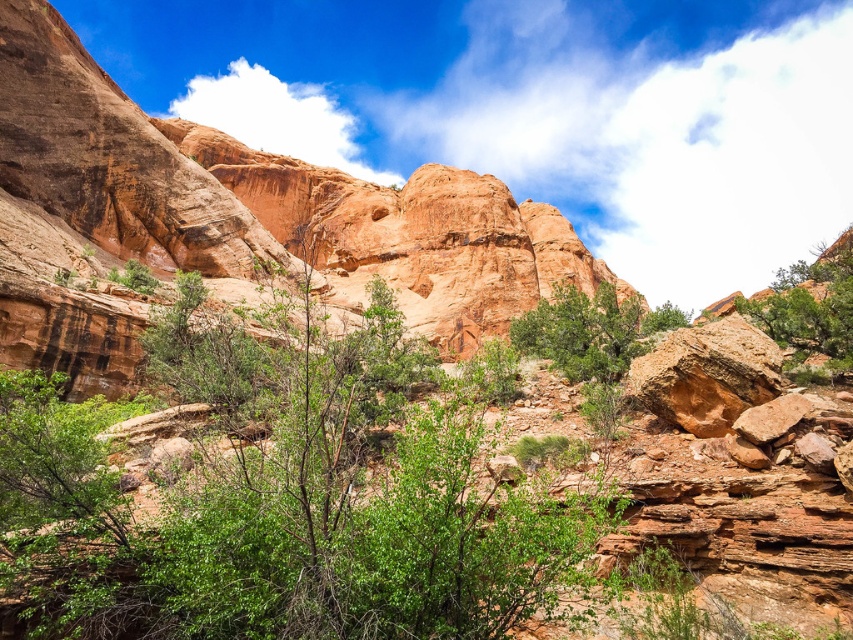
You are a hiker trying to decide which tree to rest under. You prefer a wider tree for shade. Which tree should you choose between the green leafy tree at center and the green leafy tree at right?

The green leafy tree at right is wider than the green leafy tree at center, so you should choose the green leafy tree at right for shade.

You are standing in the middle of this natural landscape and want to walk towards the closest tree. Which tree should you head towards, the green leafy tree at right or the green matte tree at center?

The green leafy tree at right is closer to the viewer than the green matte tree at center, so you should head towards the green leafy tree at right.